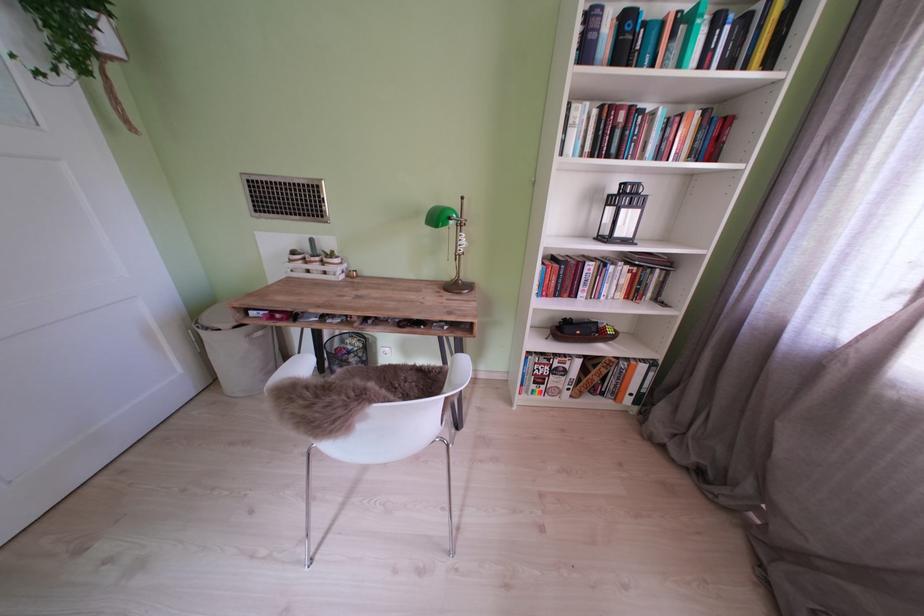
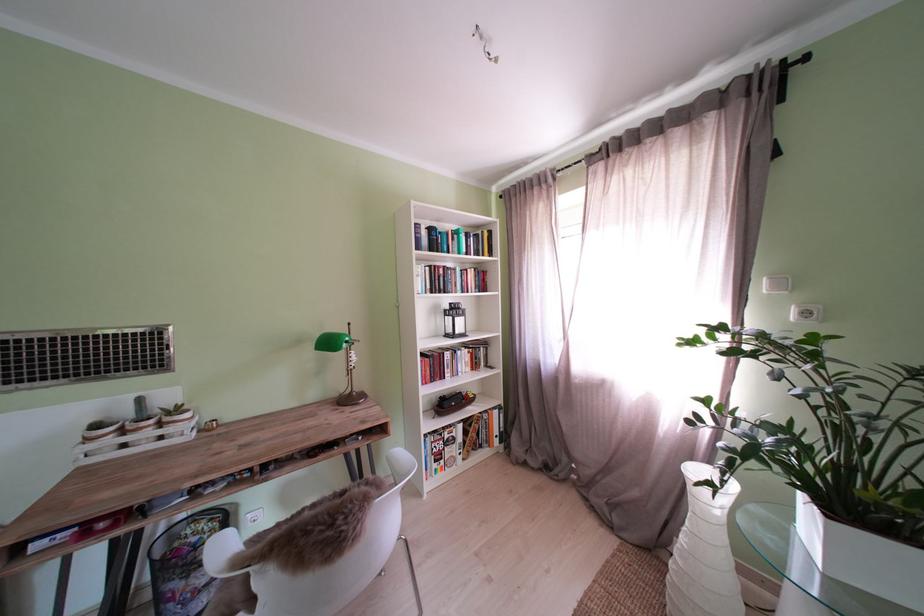
Locate, in the second image, the point that corresponds to (448,224) in the first image.

(341, 349)